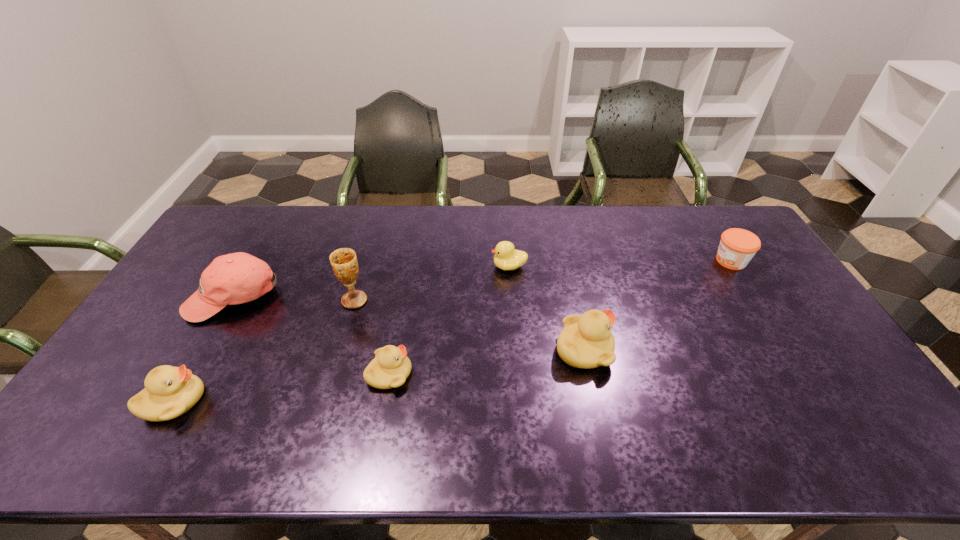
Please point out where to position a new duckling on the right to maintain spacing. Please provide its 2D coordinates. Your answer should be formatted as a tuple, i.e. [(x, y)], where the tuple contains the x and y coordinates of a point satisfying the conditions above.

[(761, 328)]